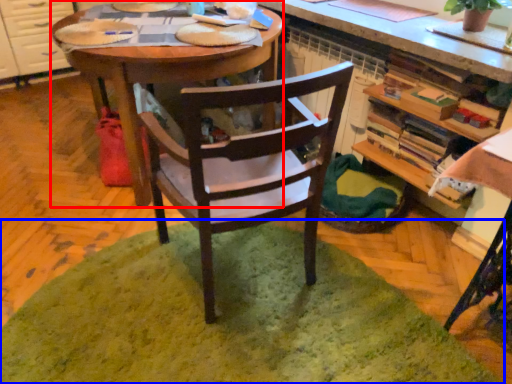
Question: Which of the following is the closest to the observer, desk (highlighted by a red box) or mat (highlighted by a blue box)?

Choices:
 (A) desk
 (B) mat

Answer: (B)